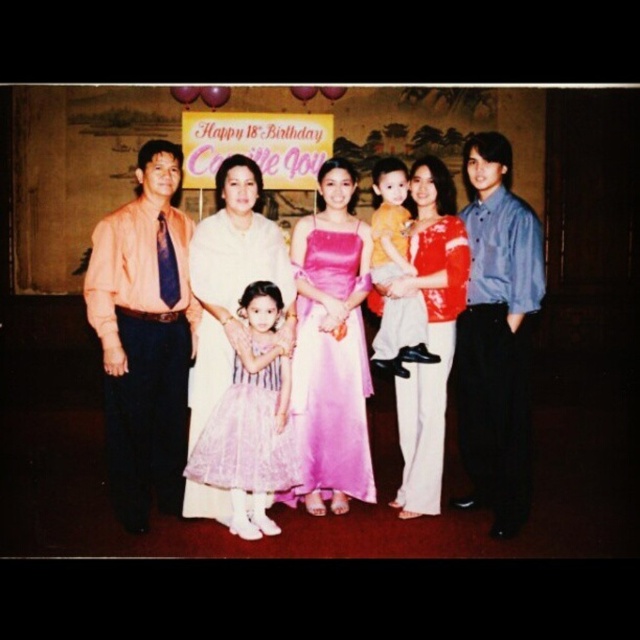
You are standing at the point labeled point (534,237) and want to take a photo of the birthday girl wearing a light purple dress with a striped pattern. The camera is 4.32 meters away from you. Can you reach the camera in time if you need to take the photo within 5 seconds?

The distance between point (534,237) and the camera is 4.32 meters. To determine if you can reach the camera within 5 seconds, we need to calculate your required speed. Assuming you move at a constant speed, the minimum speed required would be 4.32 meters divided by 5 seconds, which equals 0.864 meters per second. Since this is a reasonable walking speed, yes, you can reach the camera in time to take the photo.

You are a photographer at the birthday party and need to adjust the lighting. The blue shirt at right and the satin pink dress at center are in your frame. Which object is closer to you?

The blue shirt at right is closer to the viewer than the satin pink dress at center.